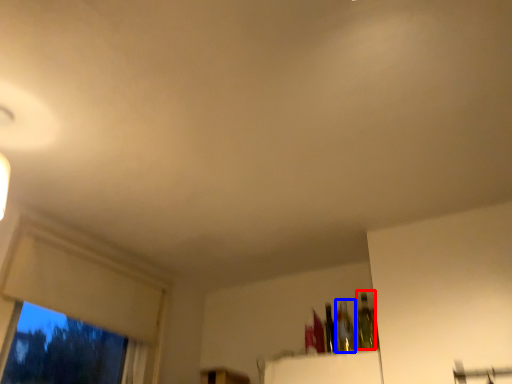
Question: Which object appears farthest to the camera in this image, bottle (highlighted by a red box) or bottle (highlighted by a blue box)?

Choices:
 (A) bottle
 (B) bottle

Answer: (B)